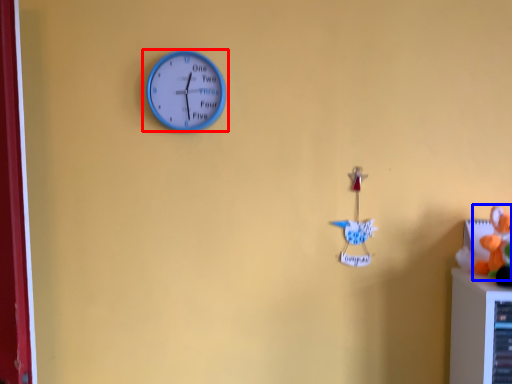
Question: Which object is closer to the camera taking this photo, wall clock (highlighted by a red box) or toy (highlighted by a blue box)?

Choices:
 (A) wall clock
 (B) toy

Answer: (B)